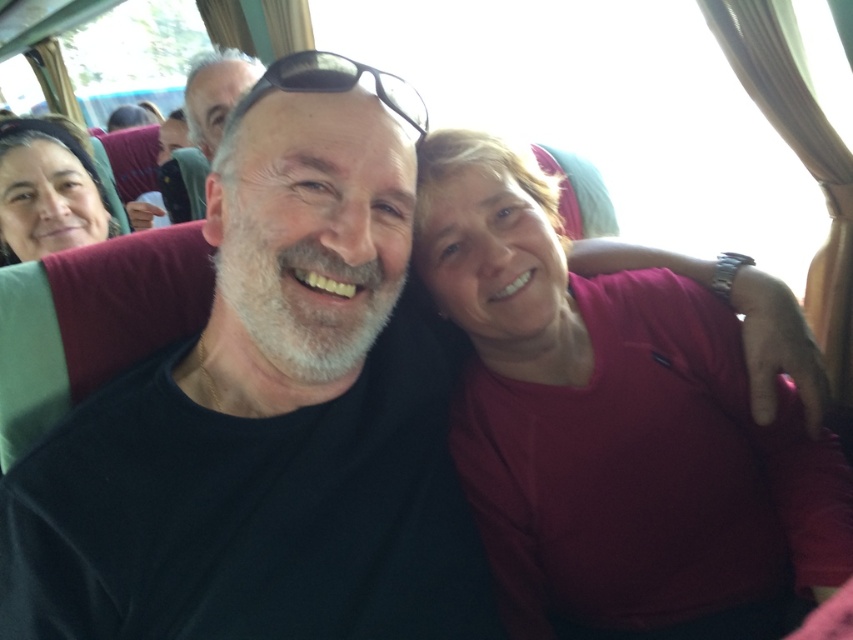
What are the coordinates of the matte red shirt at center?

The matte red shirt at center is located at point [611,419].

You are a photographer on the bus and want to take a picture of the matte red shirt at center and the matte black hair at left. Since you want both subjects to be in focus, which one should you focus on first?

You should focus on the matte black hair at left first because it is behind the matte red shirt at center, so adjusting focus from there would ensure both are in focus.

You are standing in the bus and want to place a small gift on the black matte shirt at center. The gift has a coordinate of point (268,416). Is the gift placed correctly?

Yes, the gift is placed correctly because point (268,416) is on the black matte shirt at center.